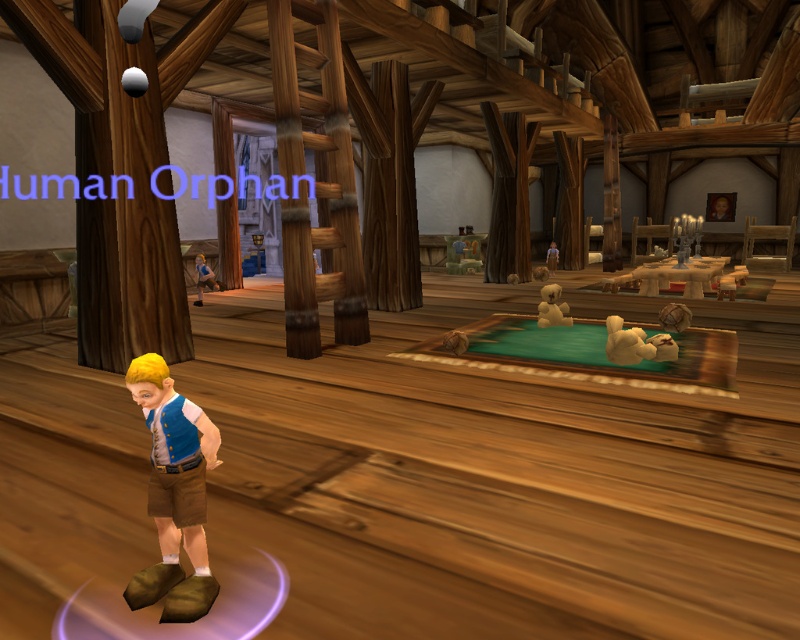
Who is more forward, [202,518] or [556,321]?

Positioned in front is point [202,518].

Who is lower down, matte blue vest at lower left or white plush bear at center?

matte blue vest at lower left is lower down.

This screenshot has width=800, height=640. What do you see at coordinates (173, 493) in the screenshot?
I see `matte blue vest at lower left` at bounding box center [173, 493].

Find the location of a particular element. This screenshot has width=800, height=640. matte blue vest at lower left is located at coordinates [173, 493].